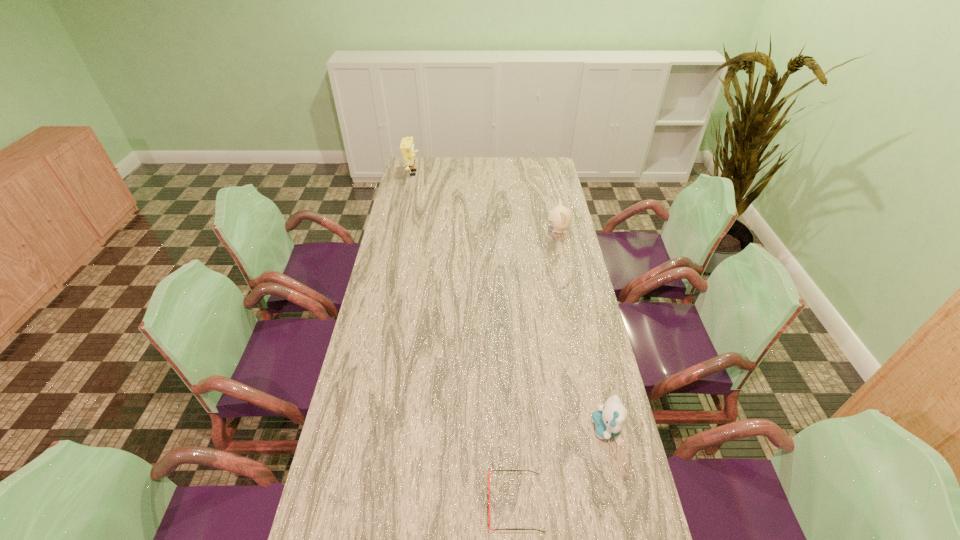
In the image, there is a desktop. At what (x,y) coordinates should I click in order to perform the action: click on vacant region at the left edge. Please return your answer as a coordinate pair (x, y). This screenshot has width=960, height=540. Looking at the image, I should click on [408, 324].

Image resolution: width=960 pixels, height=540 pixels. Find the location of `vacant space at the right edge`. vacant space at the right edge is located at coordinates (537, 212).

In order to click on vacant region between the tallest object and the farther kitten in this screenshot , I will do `click(485, 202)`.

Where is `vacant area that lies between the third farthest object and the third object from right to left`? vacant area that lies between the third farthest object and the third object from right to left is located at coordinates (561, 467).

Locate an element on the screen. This screenshot has height=540, width=960. unoccupied area between the nearer kitten and the leftmost object is located at coordinates (510, 301).

Find the location of a particular element. This screenshot has width=960, height=540. free space between the farther kitten and the leftmost object is located at coordinates (485, 202).

Where is `vacant region between the second farthest object and the tallest object`? vacant region between the second farthest object and the tallest object is located at coordinates (485, 202).

Image resolution: width=960 pixels, height=540 pixels. I want to click on vacant space that is in between the nearest object and the third nearest object, so click(537, 367).

Image resolution: width=960 pixels, height=540 pixels. I want to click on empty space between the shortest object and the sponge, so click(x=464, y=338).

Identify the location of vacant space that's between the third nearest object and the shortest object. Image resolution: width=960 pixels, height=540 pixels. (537, 367).